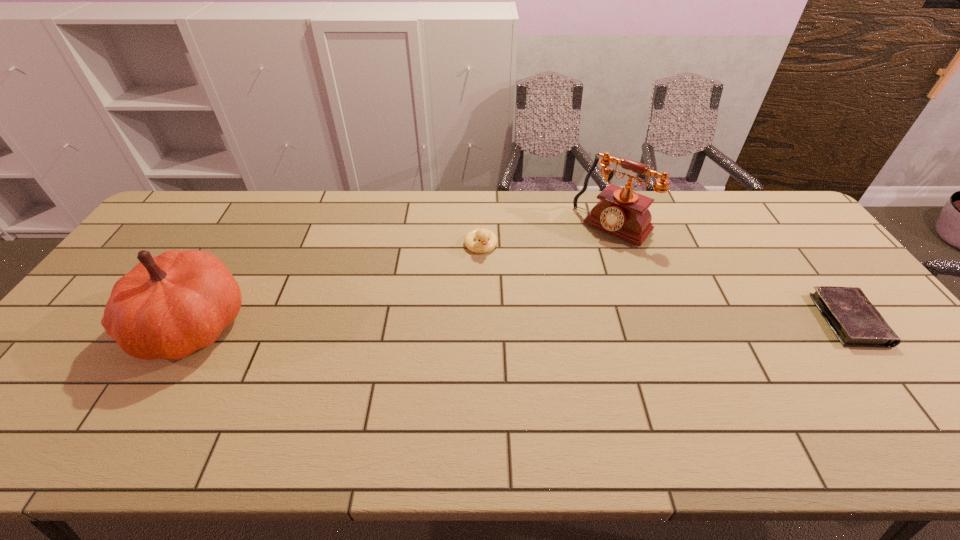
This screenshot has height=540, width=960. What are the coordinates of `the leftmost object` in the screenshot? It's located at (167, 307).

In order to click on diary in this screenshot , I will do `click(854, 320)`.

You are a GUI agent. You are given a task and a screenshot of the screen. Output one action in this format:
    pyautogui.click(x=<x>, y=<y>)
    Task: Click on the shortest object
    This screenshot has width=960, height=540.
    Given the screenshot: What is the action you would take?
    pyautogui.click(x=854, y=320)

Identify the location of the third object from left to right. (622, 212).

In order to click on duckling in this screenshot , I will do `click(487, 240)`.

Find the location of a particular element. the third tallest object is located at coordinates (487, 240).

What are the coordinates of `free space located 0.070m on the front-facing side of the pumpkin` in the screenshot? It's located at (110, 325).

Find the location of a particular element. vacant space located on the front-facing side of the pumpkin is located at coordinates (91, 325).

Find the location of a particular element. The image size is (960, 540). vacant space located 0.080m on the front-facing side of the pumpkin is located at coordinates (107, 325).

The width and height of the screenshot is (960, 540). In order to click on vacant area located on the back of the shortest object in this screenshot , I will do `click(779, 228)`.